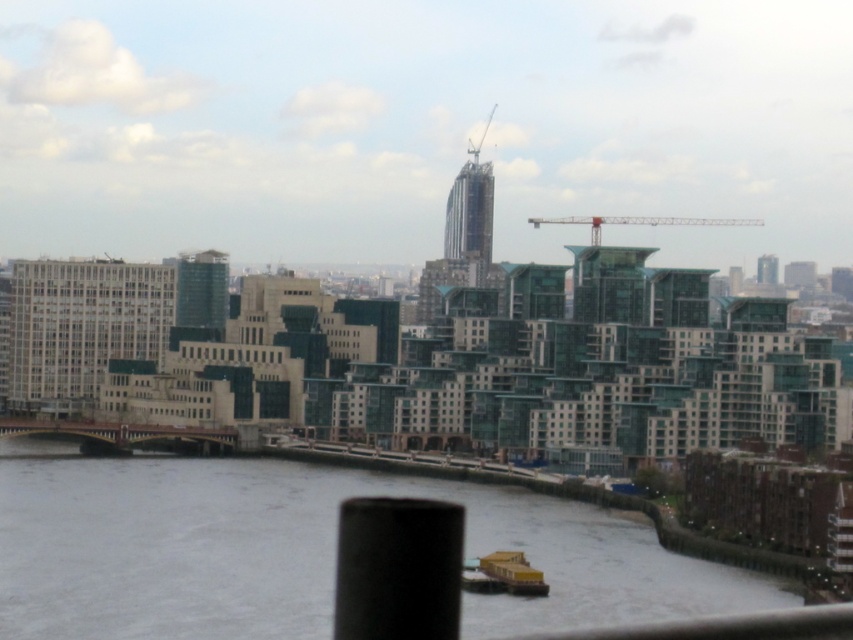
You are an architect analyzing the city skyline. You observe the metallic red crane at upper center and the metallic gray crane at upper center. Which crane is shorter in height?

The metallic red crane at upper center is shorter in height compared to the metallic gray crane at upper center.